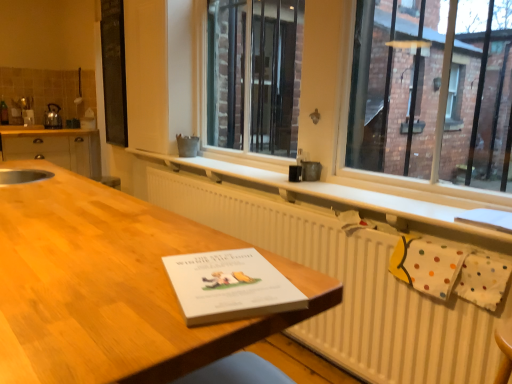
You are a GUI agent. You are given a task and a screenshot of the screen. Output one action in this format:
    pyautogui.click(x=<x>, y=<y>)
    Task: Click on the free space to the back side of white paper at center
    Image resolution: width=512 pixels, height=384 pixels.
    Given the screenshot: What is the action you would take?
    pyautogui.click(x=207, y=247)